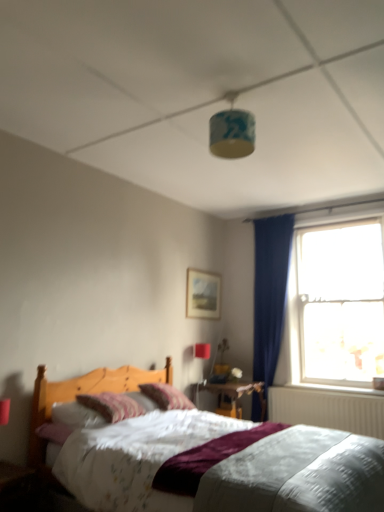
At what (x,y) coordinates should I click in order to perform the action: click on free spot above wooden picture frame at upper center (from a real-world perspective). Please return your answer as a coordinate pair (x, y). Looking at the image, I should click on (203, 272).